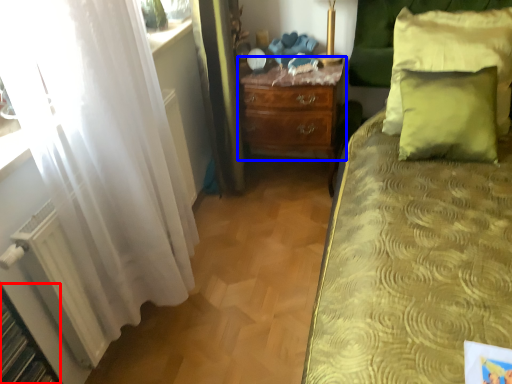
Question: Among these objects, which one is nearest to the camera, shelf (highlighted by a red box) or nightstand (highlighted by a blue box)?

Choices:
 (A) shelf
 (B) nightstand

Answer: (A)